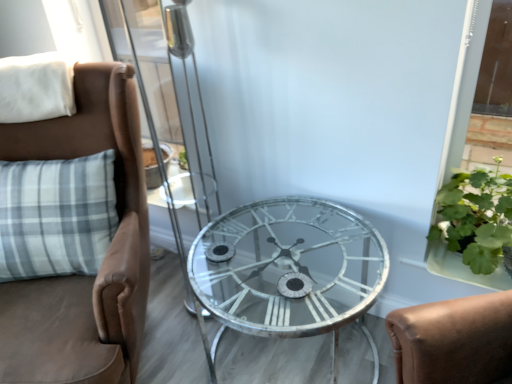
This screenshot has width=512, height=384. What do you see at coordinates (164, 100) in the screenshot?
I see `transparent glass screen door at center` at bounding box center [164, 100].

What is the approximate height of brown leather chair at left?

3.34 feet.

Describe the element at coordinates (286, 269) in the screenshot. I see `clear glass table at center` at that location.

The height and width of the screenshot is (384, 512). In order to click on transparent glass screen door at center in this screenshot , I will do `click(164, 100)`.

From the image's perspective, which is above, brown leather chair at left or clear glass table at center?

brown leather chair at left, from the image's perspective.

Is brown leather chair at left not inside clear glass table at center?

Yes.

Considering the positions of points (58, 152) and (381, 269), is point (58, 152) closer to camera compared to point (381, 269)?

That is False.

Is brown leather chair at left in front of or behind clear glass table at center in the image?

In the image, brown leather chair at left appears in front of clear glass table at center.

Is green leafy plant at right with brown leather chair at left?

No, green leafy plant at right is not touching brown leather chair at left.

From the image's perspective, is green leafy plant at right located above brown leather chair at left?

Yes, from the image's perspective, green leafy plant at right is over brown leather chair at left.

Considering the relative positions of green leafy plant at right and brown leather chair at left in the image provided, is green leafy plant at right to the left of brown leather chair at left from the viewer's perspective?

No.

Who is smaller, green leafy plant at right or brown leather chair at left?

green leafy plant at right.

Is transparent glass screen door at center completely or partially outside of clear glass table at center?

That's correct, transparent glass screen door at center is outside of clear glass table at center.

Considering the sizes of objects transparent glass screen door at center and clear glass table at center in the image provided, who is taller, transparent glass screen door at center or clear glass table at center?

transparent glass screen door at center is taller.

Can you tell me how much transparent glass screen door at center and clear glass table at center differ in facing direction?

0.926 degrees.

Is transparent glass screen door at center in contact with clear glass table at center?

No, transparent glass screen door at center is not beside clear glass table at center.

Is clear glass table at center bigger than green leafy plant at right?

Correct, clear glass table at center is larger in size than green leafy plant at right.

Can you see clear glass table at center touching green leafy plant at right?

No, clear glass table at center is not next to green leafy plant at right.

In the scene shown: Which object is positioned more to the right, clear glass table at center or green leafy plant at right?

From the viewer's perspective, green leafy plant at right appears more on the right side.

Considering the relative positions of transparent glass screen door at center and brown leather chair at left in the image provided, is transparent glass screen door at center in front of brown leather chair at left?

No, it is not.

Could you tell me if transparent glass screen door at center is turned towards brown leather chair at left?

Yes, transparent glass screen door at center is oriented towards brown leather chair at left.

Between transparent glass screen door at center and brown leather chair at left, which one appears on the right side from the viewer's perspective?

transparent glass screen door at center.

Considering the sizes of objects transparent glass screen door at center and brown leather chair at left in the image provided, who is bigger, transparent glass screen door at center or brown leather chair at left?

brown leather chair at left is bigger.

How distant is metallic silver clock face at center from white soft pillow at upper left?

3.41 feet.

Would you consider metallic silver clock face at center to be distant from white soft pillow at upper left?

Yes.

Between metallic silver clock face at center and white soft pillow at upper left, which one appears on the left side from the viewer's perspective?

Positioned to the left is white soft pillow at upper left.

Is clear glass table at center turned away from white soft pillow at upper left?

clear glass table at center is not turned away from white soft pillow at upper left.

Image resolution: width=512 pixels, height=384 pixels. Find the location of `table below the white soft pillow at upper left (from the image's perspective)`. table below the white soft pillow at upper left (from the image's perspective) is located at coordinates (286, 269).

How far apart are clear glass table at center and white soft pillow at upper left?

A distance of 35.58 inches exists between clear glass table at center and white soft pillow at upper left.

Which of these two, clear glass table at center or white soft pillow at upper left, is bigger?

With larger size is clear glass table at center.

You are a GUI agent. You are given a task and a screenshot of the screen. Output one action in this format:
    pyautogui.click(x=<x>, y=<y>)
    Task: Click on the chair that is on the left side of clear glass table at center
    Image resolution: width=512 pixels, height=384 pixels.
    Given the screenshot: What is the action you would take?
    pyautogui.click(x=104, y=258)

Identify the location of plant that is above the brown leather chair at left (from a real-world perspective). (477, 218).

Estimate the real-world distances between objects in this image. Which object is closer to clear glass table at center, transparent glass screen door at center or brown leather chair at left?

Among the two, brown leather chair at left is located nearer to clear glass table at center.

Estimate the real-world distances between objects in this image. Which object is further from transparent glass screen door at center, white soft pillow at upper left or green leafy plant at right?

green leafy plant at right is positioned further to the anchor transparent glass screen door at center.

When comparing their distances from brown leather chair at left, does transparent glass screen door at center or clear glass table at center seem closer?

clear glass table at center is closer to brown leather chair at left.

Based on their spatial positions, is clear glass table at center or brown leather chair at left closer to green leafy plant at right?

The object closer to green leafy plant at right is clear glass table at center.

Looking at the image, which one is located further to transparent glass screen door at center, metallic silver clock face at center or green leafy plant at right?

Based on the image, metallic silver clock face at center appears to be further to transparent glass screen door at center.

Looking at the image, which one is located closer to white soft pillow at upper left, transparent glass screen door at center or clear glass table at center?

transparent glass screen door at center.

Looking at the image, which one is located further to clear glass table at center, metallic silver clock face at center or transparent glass screen door at center?

transparent glass screen door at center.

From the picture: Which object lies nearer to the anchor point transparent glass screen door at center, metallic silver clock face at center or white soft pillow at upper left?

The object closer to transparent glass screen door at center is white soft pillow at upper left.

Find the location of a particular element. The height and width of the screenshot is (384, 512). screen door between white soft pillow at upper left and clear glass table at center in the horizontal direction is located at coordinates (164, 100).

The width and height of the screenshot is (512, 384). I want to click on screen door between brown leather chair at left and green leafy plant at right in the horizontal direction, so click(164, 100).

Find the location of a particular element. table between metallic silver clock face at center and green leafy plant at right is located at coordinates (286, 269).

The image size is (512, 384). Find the location of `chair situated between white soft pillow at upper left and green leafy plant at right from left to right`. chair situated between white soft pillow at upper left and green leafy plant at right from left to right is located at coordinates (104, 258).